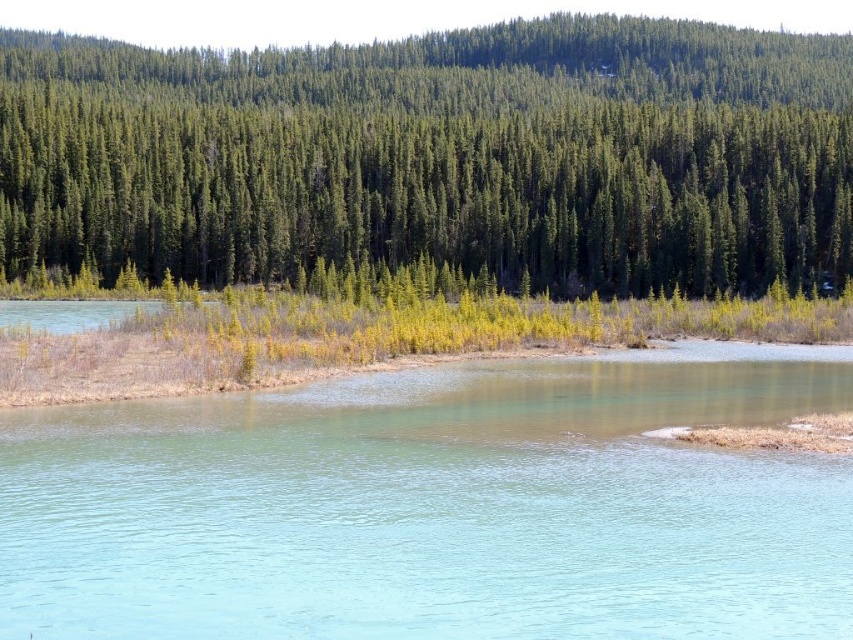
You are a kayaker planning to navigate through the clear water at center and the green matte forest at upper center. Which path offers more width for your kayak? Please consider the spatial details provided.

The clear water at center is thinner than the green matte forest at upper center, so the green matte forest at upper center offers more width for your kayak.

You are standing on the lakeside and want to take a photo of the clear water at center and the green matte forest at upper center. Which object should you focus on first if you want to capture both in a single shot without moving the camera?

You should focus on the clear water at center first because it is positioned under the green matte forest at upper center, so adjusting focus to the foreground will allow the background forest to remain in frame.